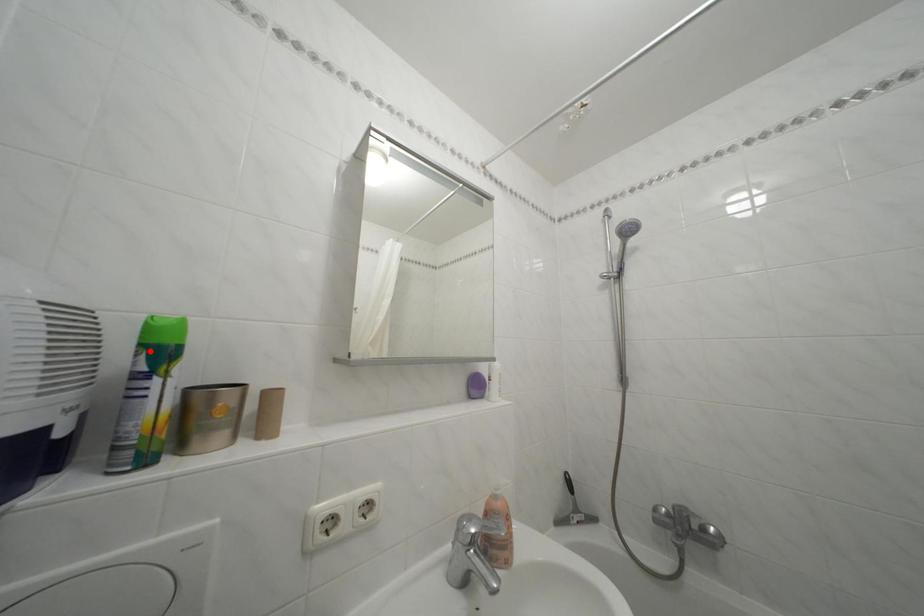
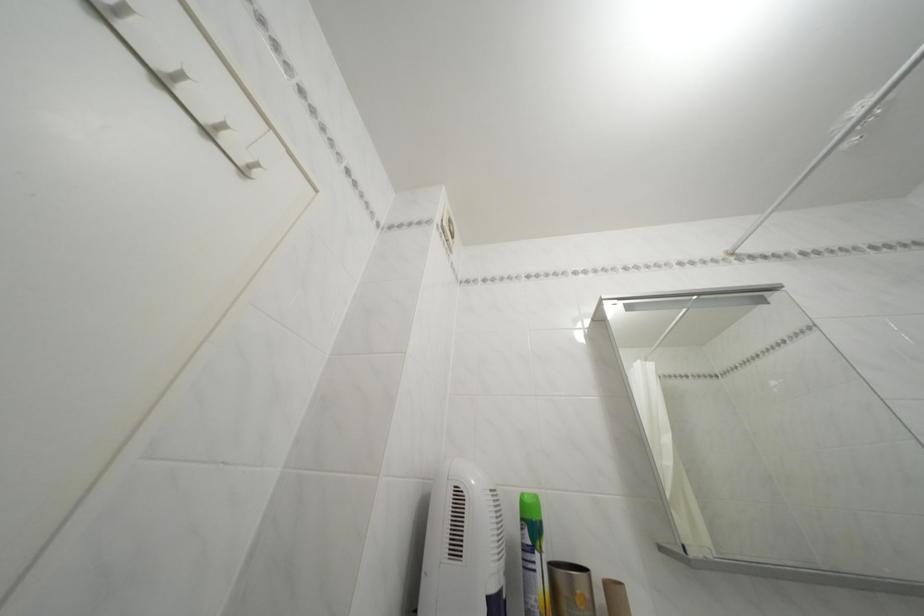
Locate, in the second image, the point that corresponds to the highlighted location in the first image.

(531, 525)